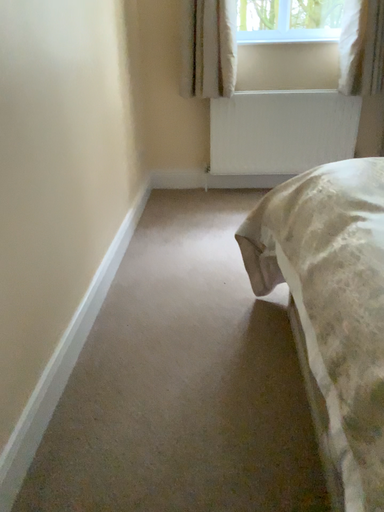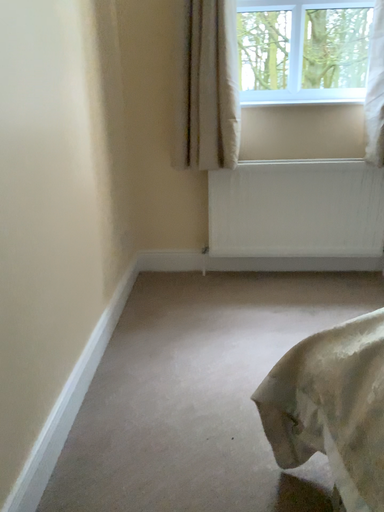
Question: Which way did the camera rotate in the video?

Choices:
 (A) rotated upward
 (B) rotated downward

Answer: (A)